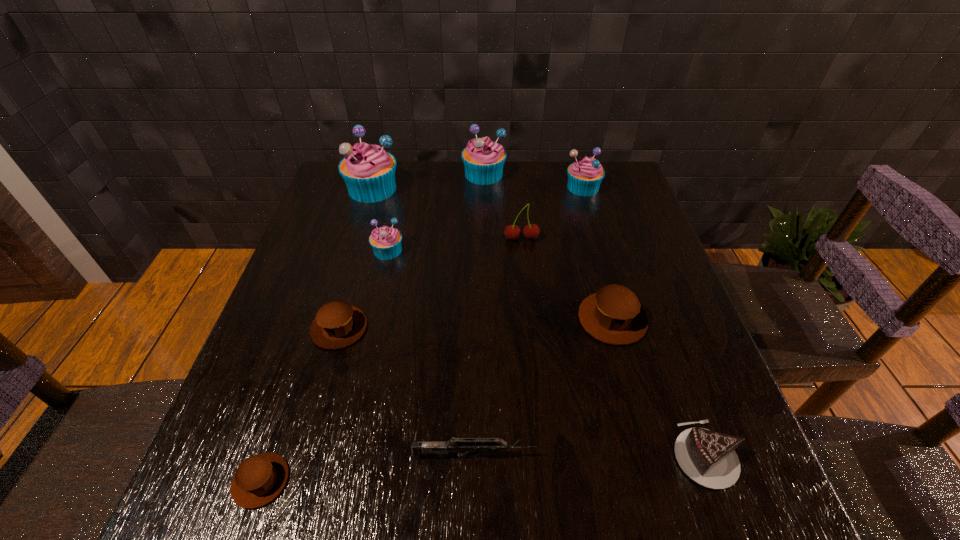
Locate an element on the screen. muffin that is the fifth closest one to the second shortest muffin is located at coordinates (483, 159).

Choose which muffin is the fifth nearest neighbor to the second smallest brown muffin. Please provide its 2D coordinates. Your answer should be formatted as a tuple, i.e. [(x, y)], where the tuple contains the x and y coordinates of a point satisfying the conditions above.

[(483, 159)]

Select which blue muffin is the second closest to the biggest blue muffin. Please provide its 2D coordinates. Your answer should be formatted as a tuple, i.e. [(x, y)], where the tuple contains the x and y coordinates of a point satisfying the conditions above.

[(483, 159)]

Select which blue muffin is the third closest to the tallest object. Please provide its 2D coordinates. Your answer should be formatted as a tuple, i.e. [(x, y)], where the tuple contains the x and y coordinates of a point satisfying the conditions above.

[(585, 175)]

Point out which brown muffin is positioned as the nearest to the smallest brown muffin. Please provide its 2D coordinates. Your answer should be formatted as a tuple, i.e. [(x, y)], where the tuple contains the x and y coordinates of a point satisfying the conditions above.

[(337, 324)]

Locate an element on the screen. The image size is (960, 540). brown muffin that can be found as the closest to the shortest muffin is located at coordinates (337, 324).

Find the location of a particular element. The width and height of the screenshot is (960, 540). vacant space that satisfies the following two spatial constraints: 1. on the surface of the chocolate cake; 2. on the left side of the cherry is located at coordinates (543, 455).

What are the coordinates of `free space that satisfies the following two spatial constraints: 1. on the surface of the cherry; 2. aimed along the barrel of the gun` in the screenshot? It's located at (543, 456).